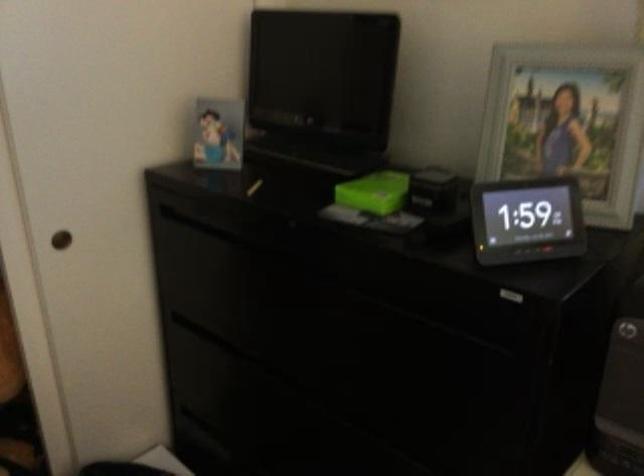
Where would you lift the green box? Please return your answer as a coordinate pair (x, y).

(374, 192)